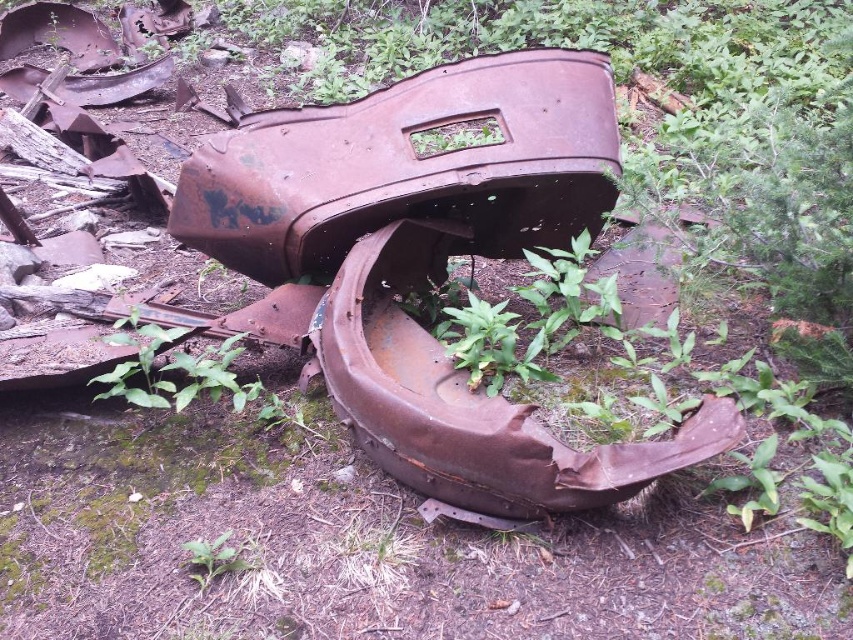
Does point (724, 406) lie in front of point (239, 556)?

Yes.

Can you confirm if rusty metal car at center is shorter than green leafy weed at lower center?

No, rusty metal car at center is not shorter than green leafy weed at lower center.

This screenshot has width=853, height=640. What are the coordinates of `rusty metal car at center` in the screenshot? It's located at (427, 264).